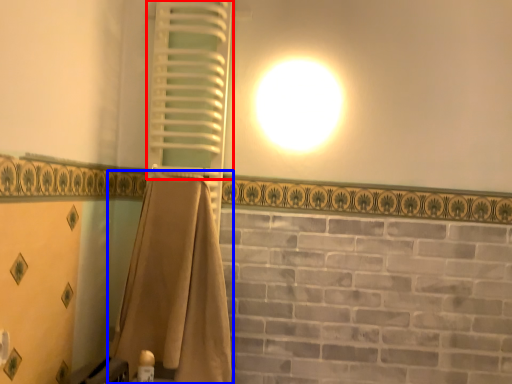
Question: Which object appears closest to the camera in this image, shutter (highlighted by a red box) or curtain (highlighted by a blue box)?

Choices:
 (A) shutter
 (B) curtain

Answer: (B)